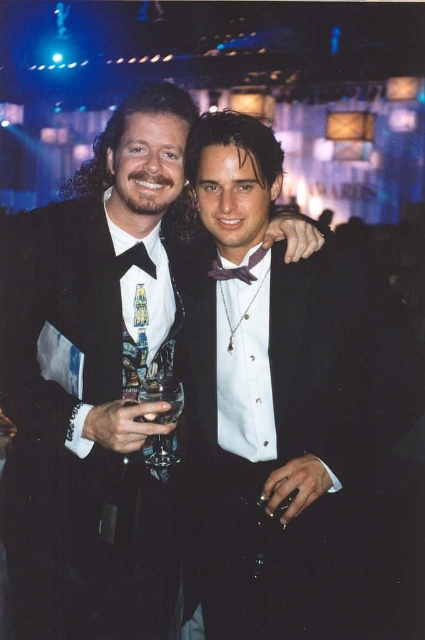
Is point (71, 392) positioned behind point (241, 276)?

No, (71, 392) is closer to viewer.

Who is positioned more to the left, black satin tuxedo at center or purple satin bow tie at center?

black satin tuxedo at center

Identify the location of black satin tuxedo at center. The image size is (425, 640). (91, 384).

Between matte black tuxedo at center and purple satin bow tie at center, which one is positioned lower?

matte black tuxedo at center is lower down.

Describe the element at coordinates (285, 433) in the screenshot. I see `matte black tuxedo at center` at that location.

Find the location of a particular element. This screenshot has height=640, width=425. matte black tuxedo at center is located at coordinates (285, 433).

Does black satin tuxedo at center appear on the left side of black satin bow tie at left?

Indeed, black satin tuxedo at center is positioned on the left side of black satin bow tie at left.

Between point (138, 428) and point (153, 268), which one is positioned behind?

The point (153, 268) is behind.

Between point (102, 248) and point (115, 259), which one is positioned behind?

Point (115, 259)

Where is `black satin tuxedo at center`? The width and height of the screenshot is (425, 640). black satin tuxedo at center is located at coordinates (91, 384).